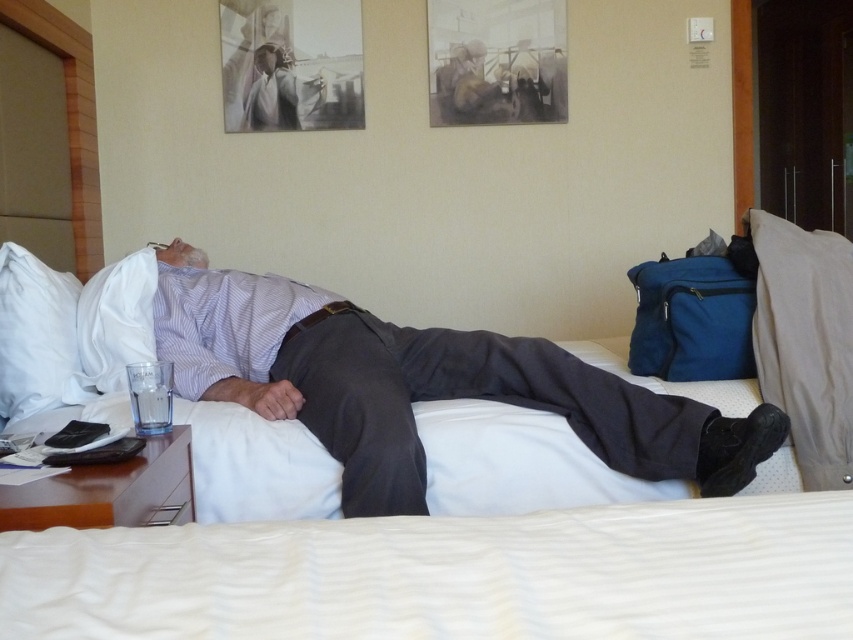
What is the exact coordinate of the matte purple shirt at center?

The matte purple shirt at center is located at point (421, 385).

You are standing in a hotel room and need to reach a specific point marked at coordinates point [618,596]. Your arms can extend up to 30 inches. Can you reach that point without moving your feet?

The distance of point [618,596] from viewer is 34.79 inches, which is beyond your arm reach of 30 inches. You cannot reach it without moving your feet.